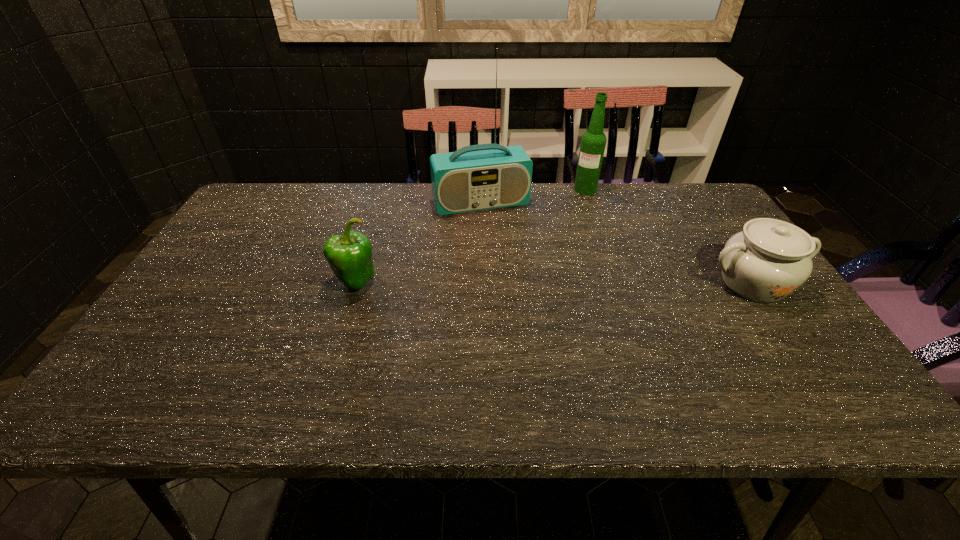
Image resolution: width=960 pixels, height=540 pixels. In order to click on free space located on the front panel of the tallest object in this screenshot , I will do `click(498, 233)`.

Identify the location of free location located 0.140m on the label of the beer bottle. This screenshot has width=960, height=540. (577, 218).

This screenshot has height=540, width=960. Identify the location of free spot located 0.320m on the label of the beer bottle. (566, 253).

Locate an element on the screen. This screenshot has height=540, width=960. vacant space situated on the label of the beer bottle is located at coordinates (573, 231).

Where is `radio receiver that is positioned at the far edge`? The height and width of the screenshot is (540, 960). radio receiver that is positioned at the far edge is located at coordinates (478, 177).

Image resolution: width=960 pixels, height=540 pixels. Find the location of `beer bottle that is positioned at the far edge`. beer bottle that is positioned at the far edge is located at coordinates (593, 141).

Find the location of a particular element. The width and height of the screenshot is (960, 540). object that is at the right edge is located at coordinates (770, 259).

In the image, there is a desktop. Find the location of `vacant space at the far edge`. vacant space at the far edge is located at coordinates (364, 214).

At what (x,y) coordinates should I click in order to perform the action: click on vacant space at the near edge of the desktop. Please return your answer as a coordinate pair (x, y). Looking at the image, I should click on (665, 346).

Where is `vacant space at the left edge`? The width and height of the screenshot is (960, 540). vacant space at the left edge is located at coordinates (260, 237).